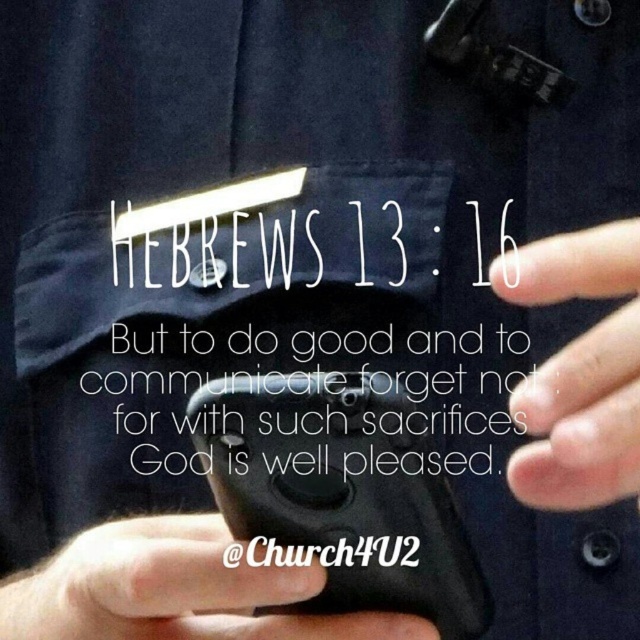
Which of these two, black matte phone at lower center or white matte finger at center, stands taller?

With more height is white matte finger at center.

Is black matte phone at lower center closer to the viewer compared to white matte finger at center?

That is False.

Is point (336, 630) positioned in front of point (598, 365)?

No.

This screenshot has width=640, height=640. I want to click on black matte phone at lower center, so click(173, 589).

Is white paper at center to the right of white matte finger at center from the viewer's perspective?

In fact, white paper at center is to the left of white matte finger at center.

Can you confirm if white paper at center is shorter than white matte finger at center?

No.

This screenshot has height=640, width=640. I want to click on white paper at center, so click(301, 344).

Where is `white paper at center`? The image size is (640, 640). white paper at center is located at coordinates (301, 344).

Who is more forward, (147, 451) or (1, 589)?

Positioned in front is point (147, 451).

Which is behind, point (84, 392) or point (176, 608)?

Point (84, 392)

The height and width of the screenshot is (640, 640). Identify the location of white paper at center. (301, 344).